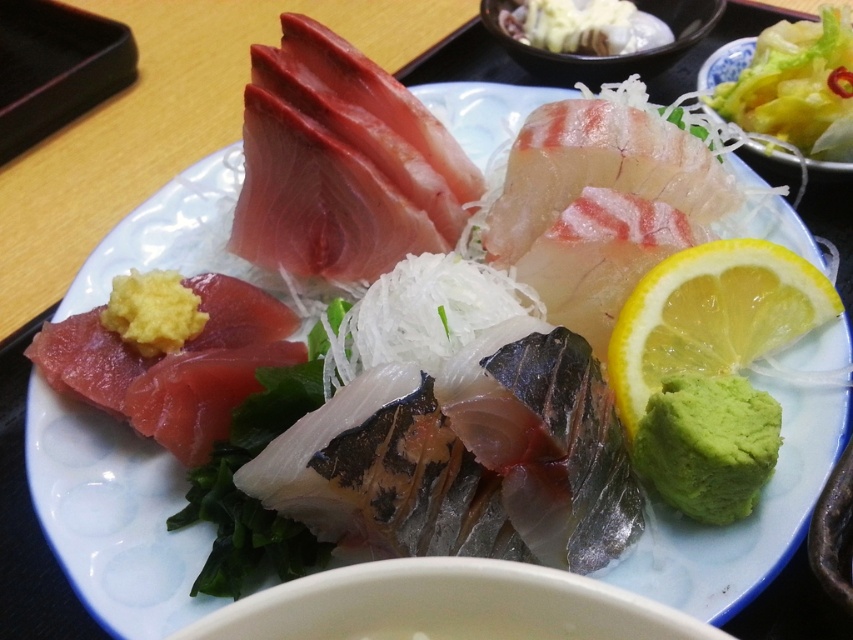
Is point (747, 328) farther from viewer compared to point (788, 136)?

That is False.

Between point (654, 365) and point (773, 97), which one is positioned in front?

Point (654, 365)

The height and width of the screenshot is (640, 853). In order to click on yellow juicy lemon at right in this screenshot , I will do `click(712, 316)`.

Based on the photo, can you confirm if yellow juicy lemon at right is positioned above green paste at lower right?

Yes.

Is yellow juicy lemon at right further to the viewer compared to green paste at lower right?

Yes, it is.

Is point (706, 272) farther from viewer compared to point (703, 461)?

Yes, it is behind point (703, 461).

The image size is (853, 640). I want to click on yellow juicy lemon at right, so 712,316.

From the picture: Does green paste at lower right appear under translucent white shredded vegetables at upper right?

Yes.

Is point (764, 460) closer to camera compared to point (787, 22)?

Yes.

Find the location of a particular element. The width and height of the screenshot is (853, 640). green paste at lower right is located at coordinates (708, 444).